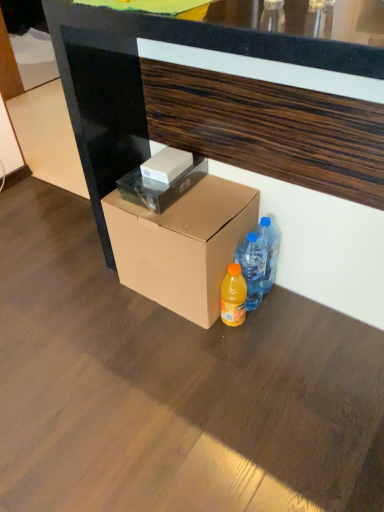
At what (x,y) coordinates should I click in order to perform the action: click on vacant space situated above brown cardboard box at lower center, the 3th box from the top (from a real-world perspective). Please return your answer as a coordinate pair (x, y). This screenshot has height=512, width=384. Looking at the image, I should click on (196, 202).